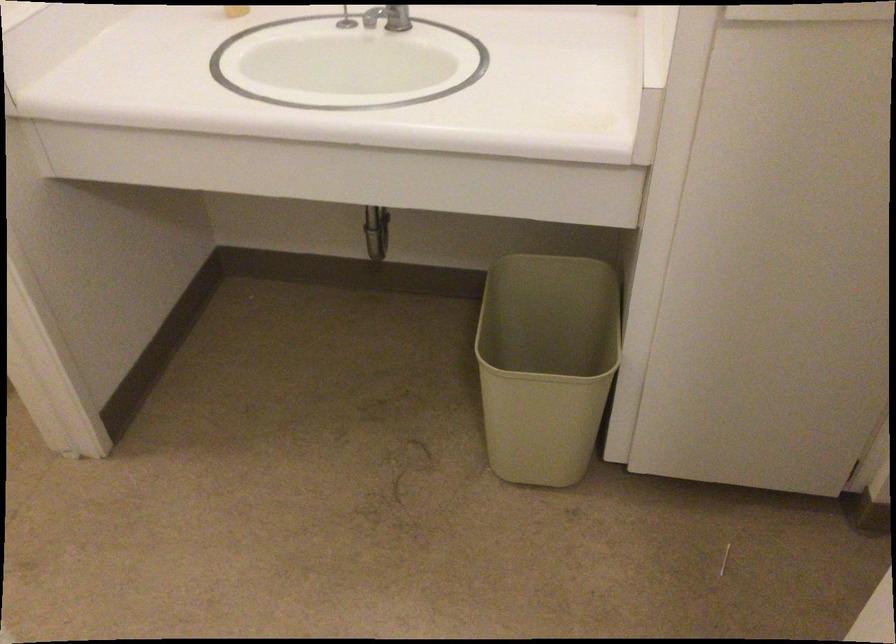
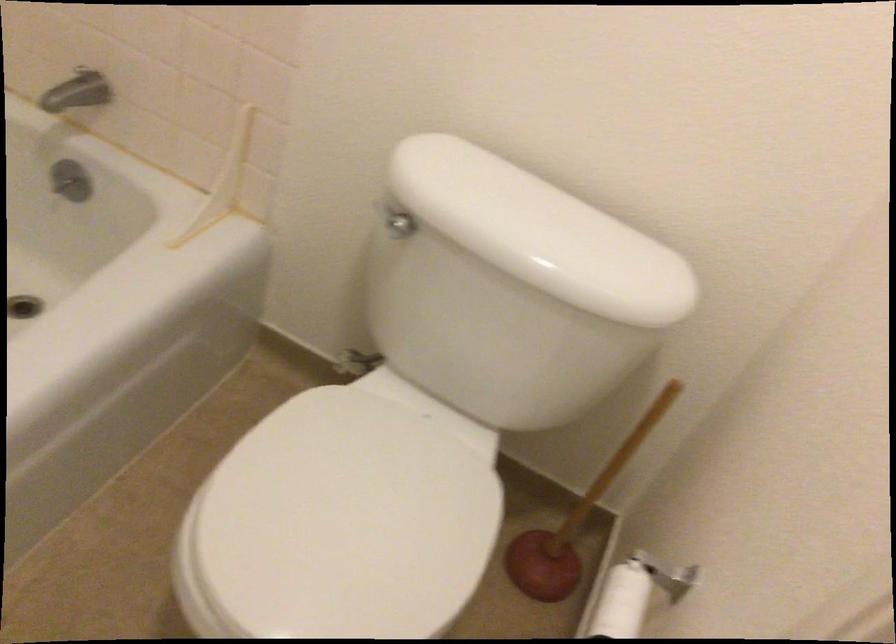
The images are taken continuously from a first-person perspective. In which direction are you moving?

The cameraman walked toward left, forward.